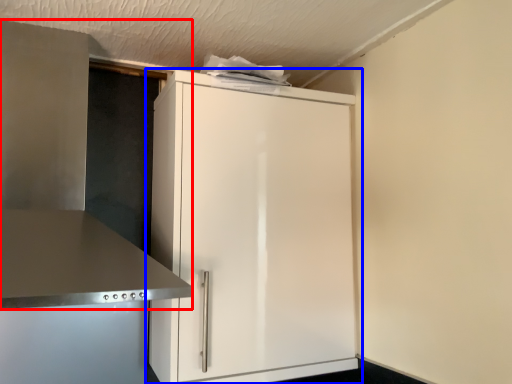
Question: Which object is closer to the camera taking this photo, vent (highlighted by a red box) or cupboard (highlighted by a blue box)?

Choices:
 (A) vent
 (B) cupboard

Answer: (A)